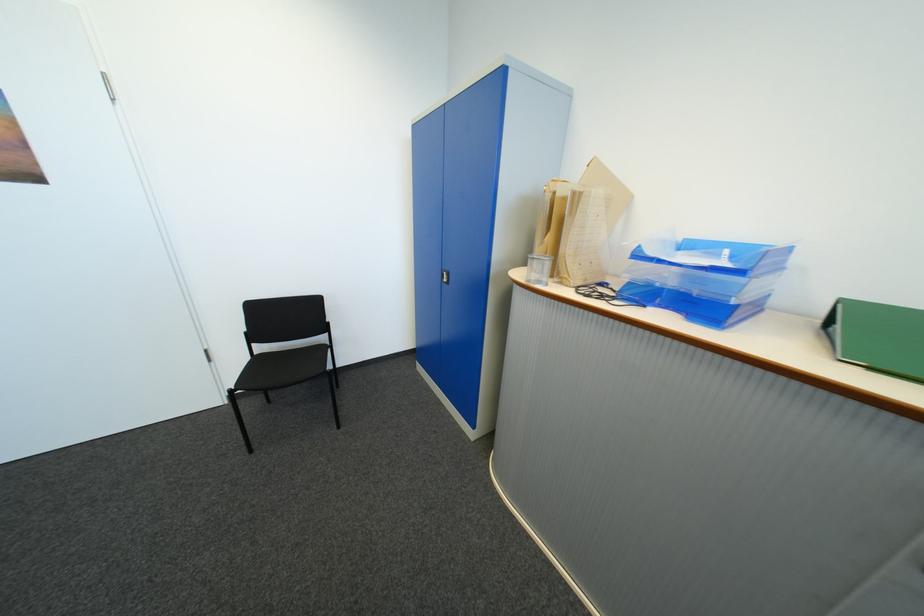
You are a GUI agent. You are given a task and a screenshot of the screen. Output one action in this format:
    pyautogui.click(x=<x>, y=<y>)
    Task: Click on the blue paper tray
    Image resolution: width=924 pixels, height=616 pixels.
    Given the screenshot: What is the action you would take?
    (x=709, y=267)